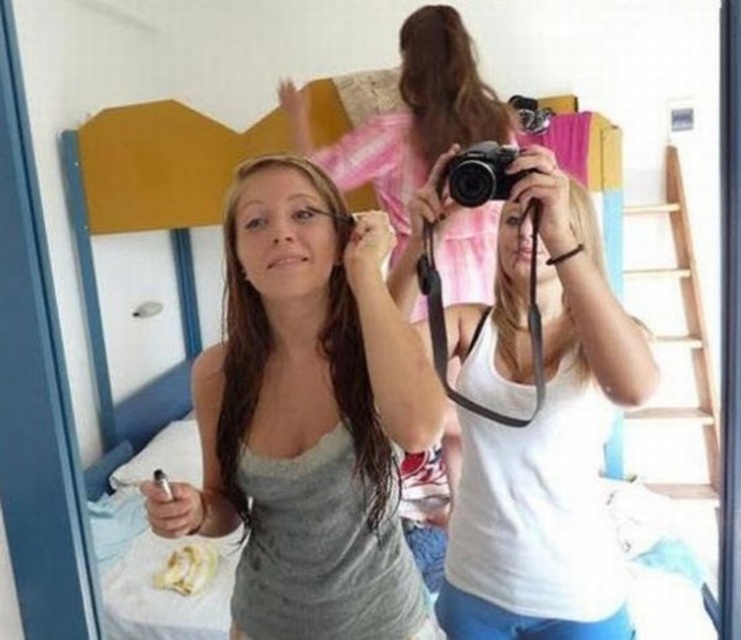
Question: Among these objects, which one is farthest from the camera?

Choices:
 (A) wooden ladder at right
 (B) matte white tank top at center
 (C) black plastic camera at center

Answer: (A)

Question: Among these points, which one is nearest to the camera?

Choices:
 (A) (468, 529)
 (B) (459, 195)
 (C) (353, 276)

Answer: (B)

Question: Can you confirm if matte white tank top at center is positioned to the right of black plastic camera at center?

Choices:
 (A) yes
 (B) no

Answer: (B)

Question: Is wooden ladder at right smaller than black plastic camera at center?

Choices:
 (A) yes
 (B) no

Answer: (B)

Question: Is matte white tank top at center wider than wooden ladder at right?

Choices:
 (A) no
 (B) yes

Answer: (B)

Question: Considering the real-world distances, which object is closest to the white matte tank top at center?

Choices:
 (A) black plastic camera at center
 (B) wooden ladder at right

Answer: (A)